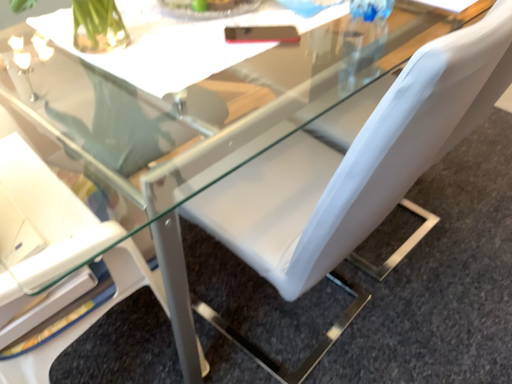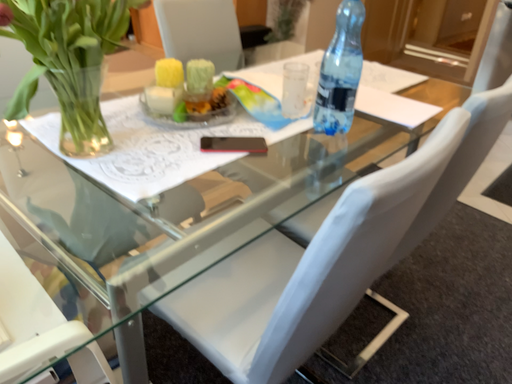
Question: How did the camera likely rotate when shooting the video?

Choices:
 (A) rotated downward
 (B) rotated upward

Answer: (B)